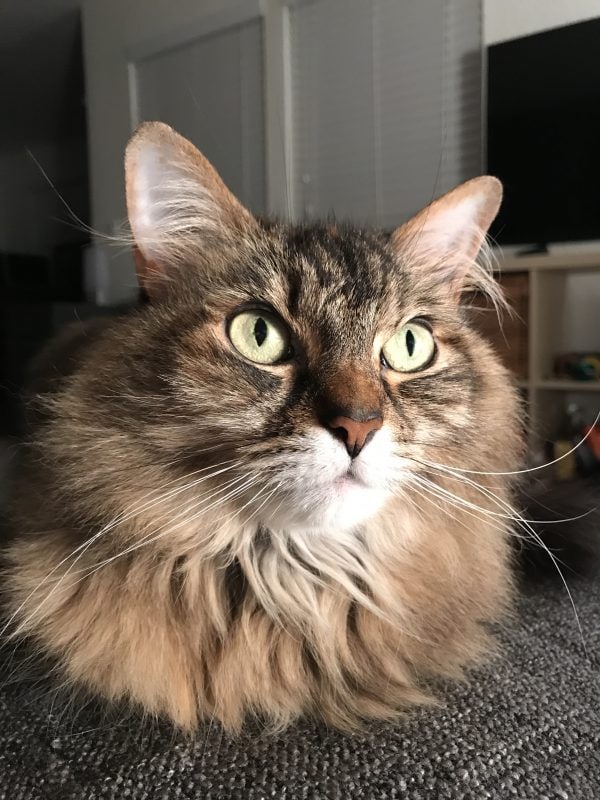
Identify the location of blinds. (393, 118).